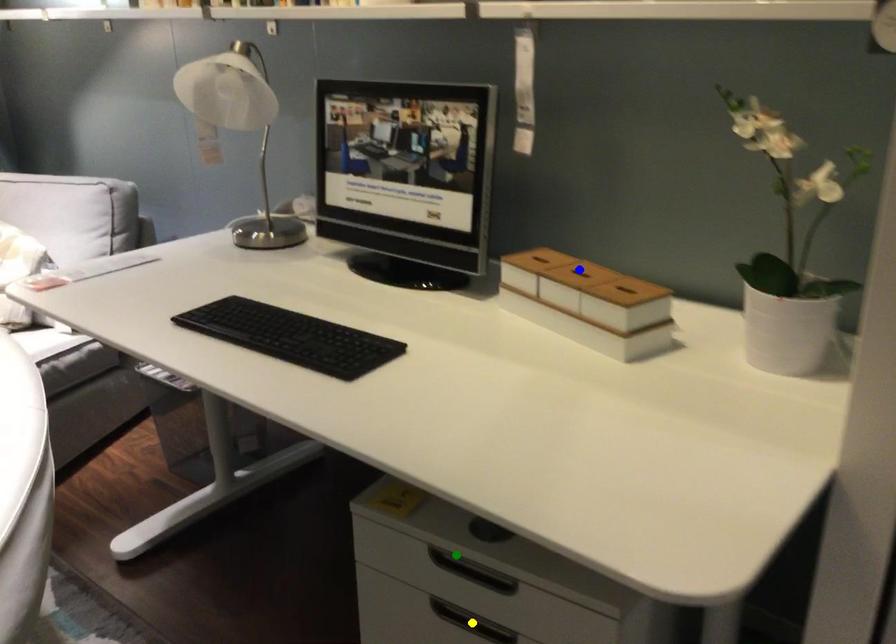
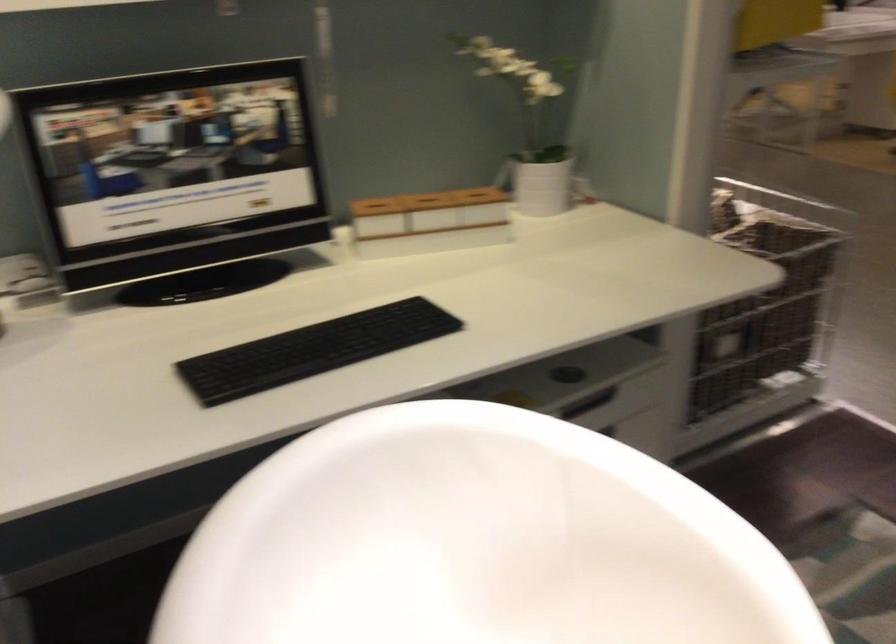
I am providing you with two images of the same scene from different viewpoints. Three points are marked in image1. Which point corresponds to a part or object that is occluded in image2?In image1, three points are marked. Which of them correspond to a part or object that is occluded in image2?Among the three points shown in image1, which one corresponds to a part or object that is no longer visible due to occlusion in image2?

yellow point cannot be seen in image2.